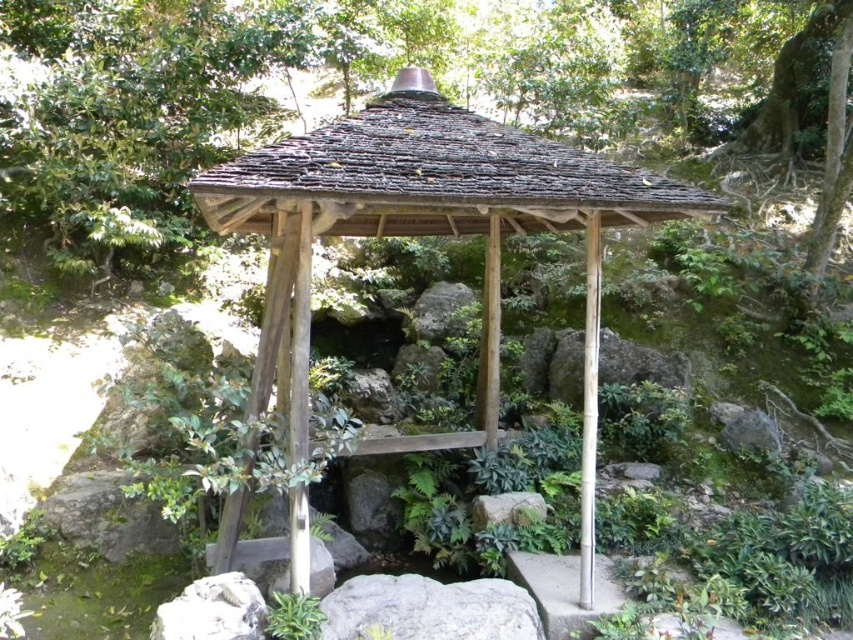
You are planning to take a photo of the wooden gazebo at center and the green leafy tree at center from a distance. Which object will appear wider in the photo?

The green leafy tree at center will appear wider in the photo because its width is larger than the wooden gazebo at center.

You are standing in front of the traditional Japanese pavilion and notice two points marked in the scene. The first point is at coordinates point (369,22) and the second is at point (453,436). Which of these two points is closer to you?

Point (369,22) is closer to you because it is further to the camera than point (453,436).

You are standing in the traditional Japanese pavilion and want to exit towards the green leafy tree at center. Which direction should you walk relative to the wooden gazebo at center?

The green leafy tree at center is to the right of the wooden gazebo at center, so you should walk to the right of the wooden gazebo at center to reach the green leafy tree at center.